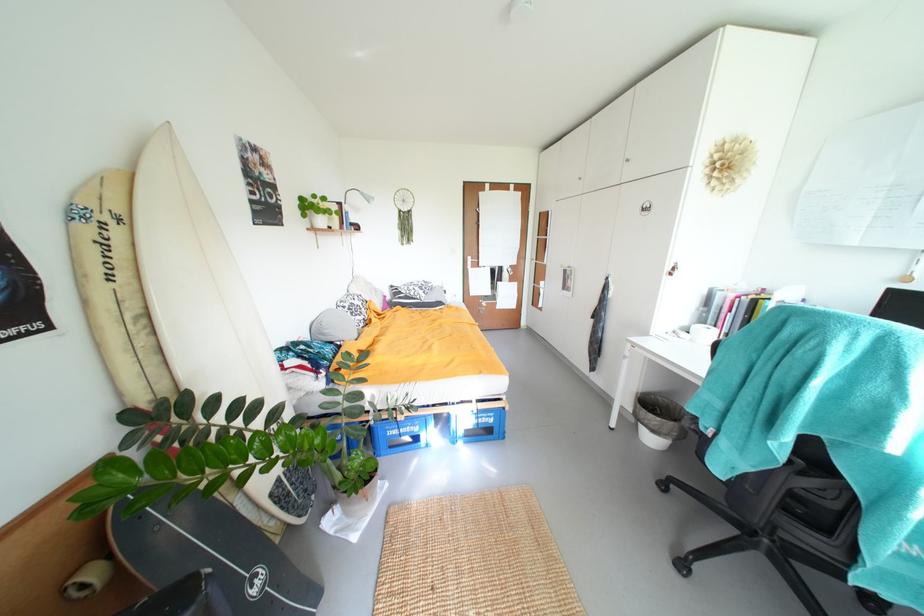
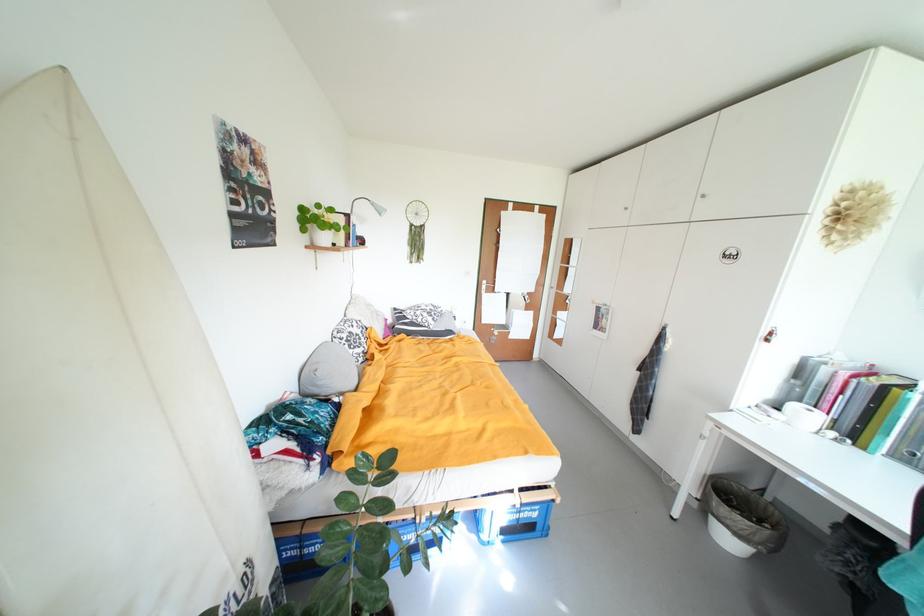
Find the pixel in the second image that matches (659,442) in the first image.

(736, 544)